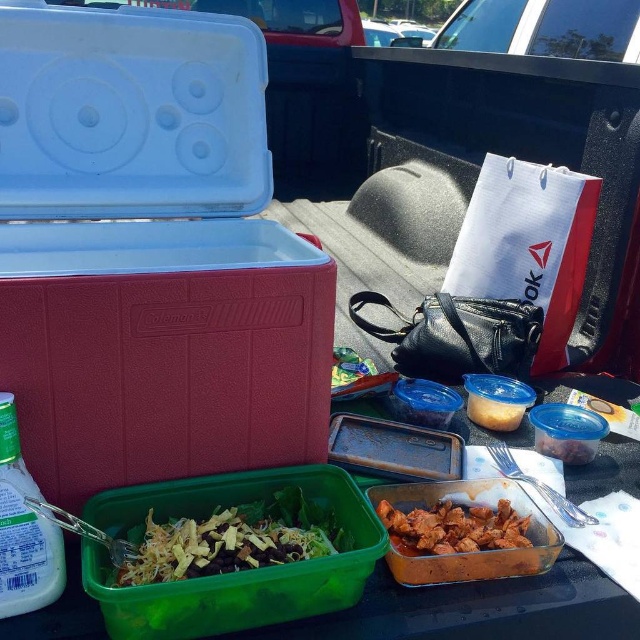
Question: Can you confirm if green plastic container at lower center is positioned to the left of shiny brown meat at center?

Choices:
 (A) no
 (B) yes

Answer: (A)

Question: Considering the real-world distances, which object is closest to the shiny brown meat at center?

Choices:
 (A) translucent plastic lunch box at lower left
 (B) green plastic salad bowl at center
 (C) green plastic container at lower center

Answer: (C)

Question: Does translucent plastic lunch box at lower left appear on the left side of shiny brown meat at center?

Choices:
 (A) yes
 (B) no

Answer: (A)

Question: Can you confirm if green plastic container at lower center is smaller than shiny brown meat at center?

Choices:
 (A) no
 (B) yes

Answer: (A)

Question: Which is farther from the green plastic salad bowl at center?

Choices:
 (A) green plastic container at lower center
 (B) translucent plastic lunch box at lower left
 (C) shiny brown meat at center

Answer: (B)

Question: Which object is closer to the camera taking this photo?

Choices:
 (A) shiny brown meat at center
 (B) green plastic salad bowl at center
 (C) translucent plastic lunch box at lower left
 (D) green plastic container at lower center

Answer: (C)